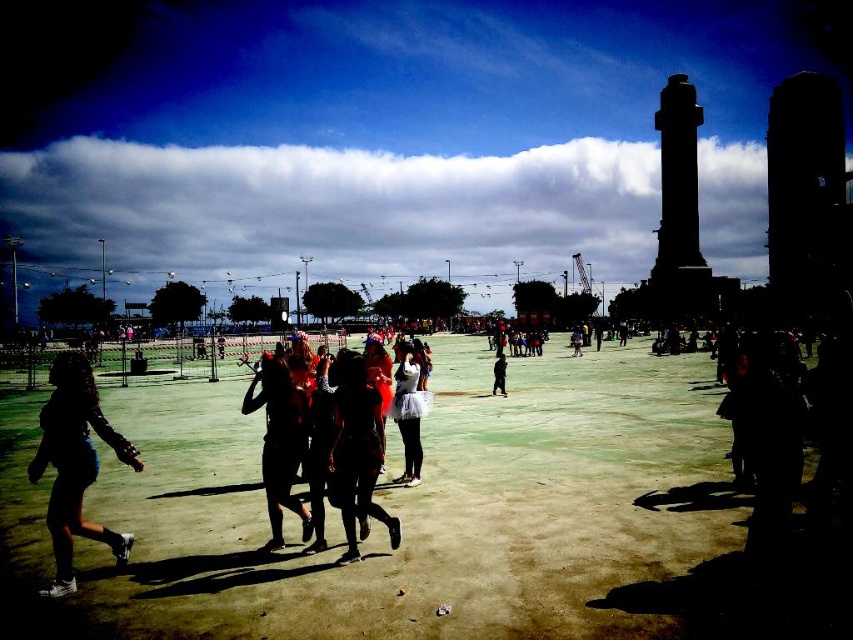
Who is lower down, black fabric dress at center or matte black dress at center?

black fabric dress at center

Is point (247, 413) closer to camera compared to point (579, 330)?

Yes, point (247, 413) is in front of point (579, 330).

Measure the distance between black fabric dress at center and camera.

They are 53.15 meters apart.

At what (x,y) coordinates should I click in order to perform the action: click on black fabric dress at center. Please return your answer as a coordinate pair (x, y). This screenshot has width=853, height=640. Looking at the image, I should click on (280, 442).

Can you confirm if green grass at center is taller than shiny metallic dress at center?

No.

Describe the element at coordinates (430, 518) in the screenshot. I see `green grass at center` at that location.

Where is `green grass at center`? Image resolution: width=853 pixels, height=640 pixels. green grass at center is located at coordinates (430, 518).

Does point (231, 506) lie behind point (85, 371)?

That is True.

Does green grass at center have a greater height compared to silhouette fabric at lower left?

No, green grass at center is not taller than silhouette fabric at lower left.

Image resolution: width=853 pixels, height=640 pixels. Find the location of `green grass at center`. green grass at center is located at coordinates (430, 518).